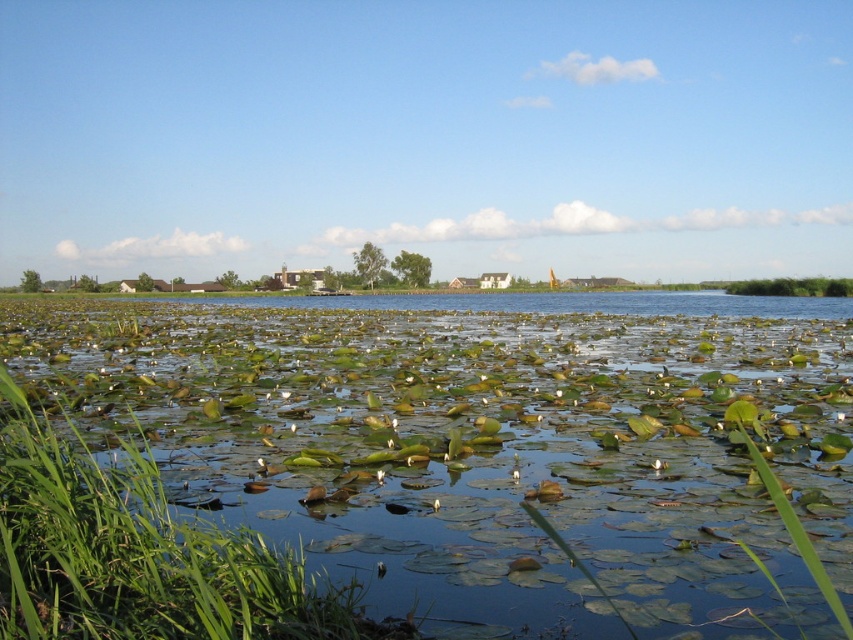
Question: Which object is closer to the camera taking this photo?

Choices:
 (A) green leafy vegetation at right
 (B) green leafy pond at center

Answer: (B)

Question: Which point is closer to the camera?

Choices:
 (A) green leafy vegetation at right
 (B) green leafy pond at center

Answer: (B)

Question: Is green leafy pond at center closer to the viewer compared to green leafy vegetation at right?

Choices:
 (A) no
 (B) yes

Answer: (B)

Question: Does green leafy pond at center lie in front of green leafy vegetation at right?

Choices:
 (A) yes
 (B) no

Answer: (A)

Question: Which object is closer to the camera taking this photo?

Choices:
 (A) green leafy pond at center
 (B) green leafy vegetation at right

Answer: (A)

Question: Can you confirm if green leafy pond at center is smaller than green leafy vegetation at right?

Choices:
 (A) no
 (B) yes

Answer: (A)